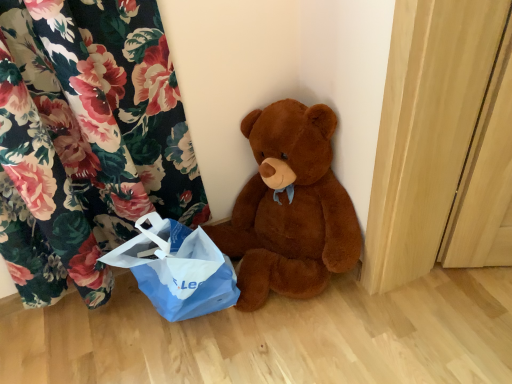
Question: From a real-world perspective, is brown plush teddy bear at center over blue paper bag at lower left?

Choices:
 (A) no
 (B) yes

Answer: (B)

Question: Would you consider brown plush teddy bear at center to be distant from blue paper bag at lower left?

Choices:
 (A) yes
 (B) no

Answer: (B)

Question: Is brown plush teddy bear at center in front of blue paper bag at lower left?

Choices:
 (A) yes
 (B) no

Answer: (A)

Question: Does brown plush teddy bear at center have a smaller size compared to blue paper bag at lower left?

Choices:
 (A) no
 (B) yes

Answer: (A)

Question: Is brown plush teddy bear at center touching blue paper bag at lower left?

Choices:
 (A) no
 (B) yes

Answer: (A)

Question: Is brown plush teddy bear at center completely or partially outside of blue paper bag at lower left?

Choices:
 (A) no
 (B) yes

Answer: (B)

Question: Is blue paper bag at lower left outside brown plush teddy bear at center?

Choices:
 (A) no
 (B) yes

Answer: (B)

Question: From the image's perspective, does blue paper bag at lower left appear higher than brown plush teddy bear at center?

Choices:
 (A) yes
 (B) no

Answer: (B)

Question: Can you see blue paper bag at lower left touching brown plush teddy bear at center?

Choices:
 (A) no
 (B) yes

Answer: (A)

Question: Is blue paper bag at lower left closer to camera compared to brown plush teddy bear at center?

Choices:
 (A) no
 (B) yes

Answer: (A)

Question: Is blue paper bag at lower left at the right side of brown plush teddy bear at center?

Choices:
 (A) yes
 (B) no

Answer: (B)

Question: From the image's perspective, is blue paper bag at lower left under brown plush teddy bear at center?

Choices:
 (A) no
 (B) yes

Answer: (B)

Question: From the image's perspective, relative to blue paper bag at lower left, is brown plush teddy bear at center above or below?

Choices:
 (A) above
 (B) below

Answer: (A)